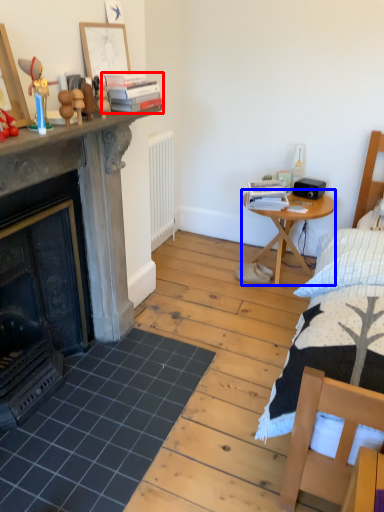
Question: Among these objects, which one is nearest to the camera, book (highlighted by a red box) or nightstand (highlighted by a blue box)?

Choices:
 (A) book
 (B) nightstand

Answer: (A)